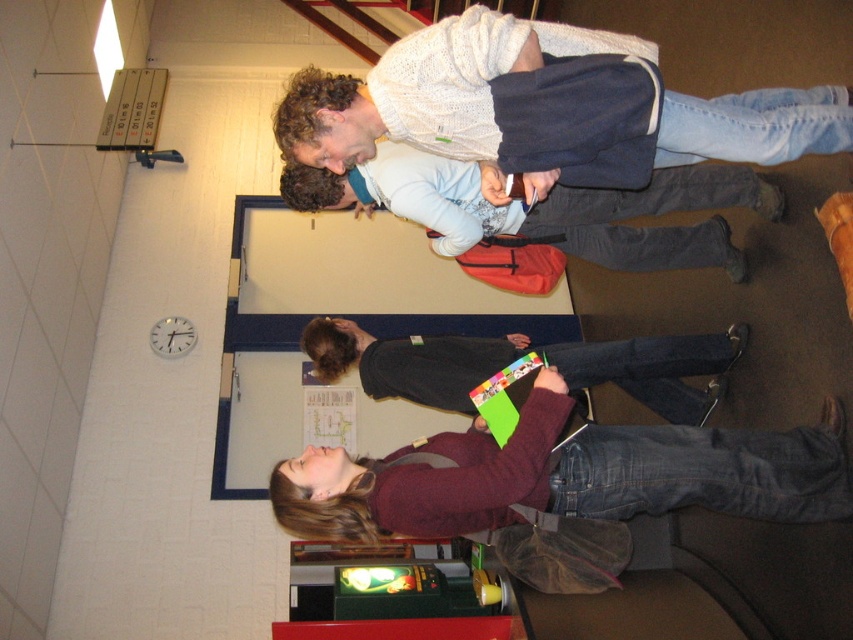
Question: Does knitted white sweater at upper center appear on the right side of dark gray sweater at center?

Choices:
 (A) no
 (B) yes

Answer: (B)

Question: Which object is positioned farthest from the matte blue backpack at center?

Choices:
 (A) knitted white sweater at upper center
 (B) dark gray sweater at center

Answer: (A)

Question: Which of the following is the closest to the observer?

Choices:
 (A) knitted white sweater at upper center
 (B) dark gray sweater at center
 (C) maroon fabric shirt at lower center

Answer: (A)

Question: Is matte blue backpack at center below dark gray sweater at center?

Choices:
 (A) no
 (B) yes

Answer: (A)

Question: Which of the following is the closest to the observer?

Choices:
 (A) knitted white sweater at upper center
 (B) matte blue backpack at center

Answer: (A)

Question: Is maroon fabric shirt at lower center above matte blue backpack at center?

Choices:
 (A) yes
 (B) no

Answer: (B)